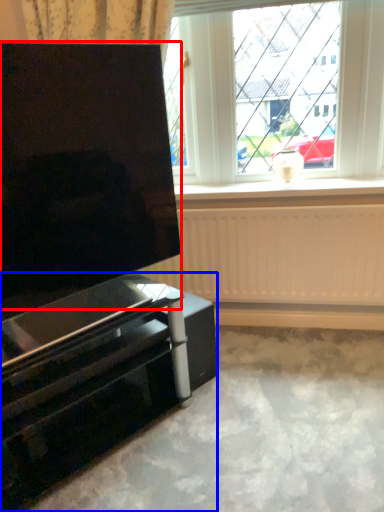
Question: Which object is closer to the camera taking this photo, screen (highlighted by a red box) or furniture (highlighted by a blue box)?

Choices:
 (A) screen
 (B) furniture

Answer: (A)